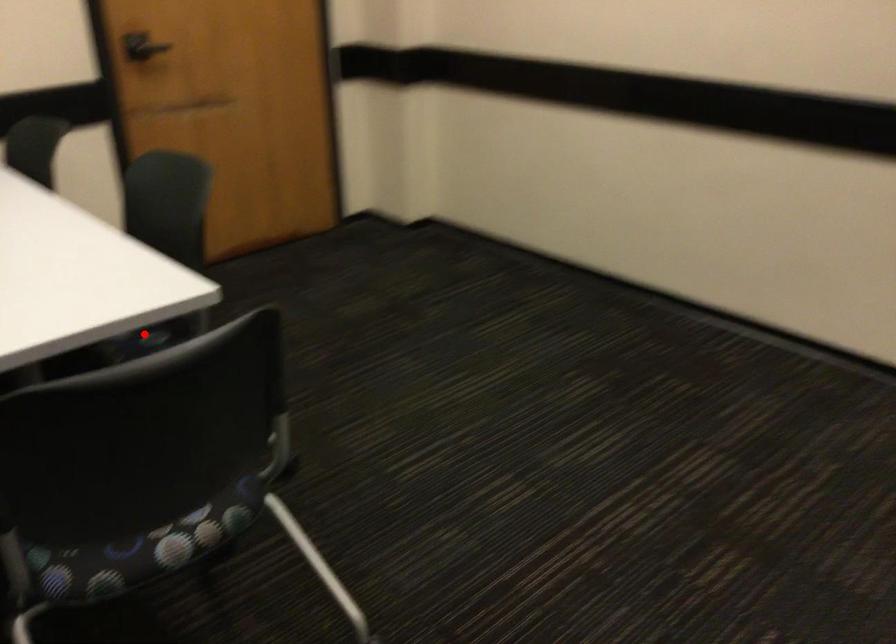
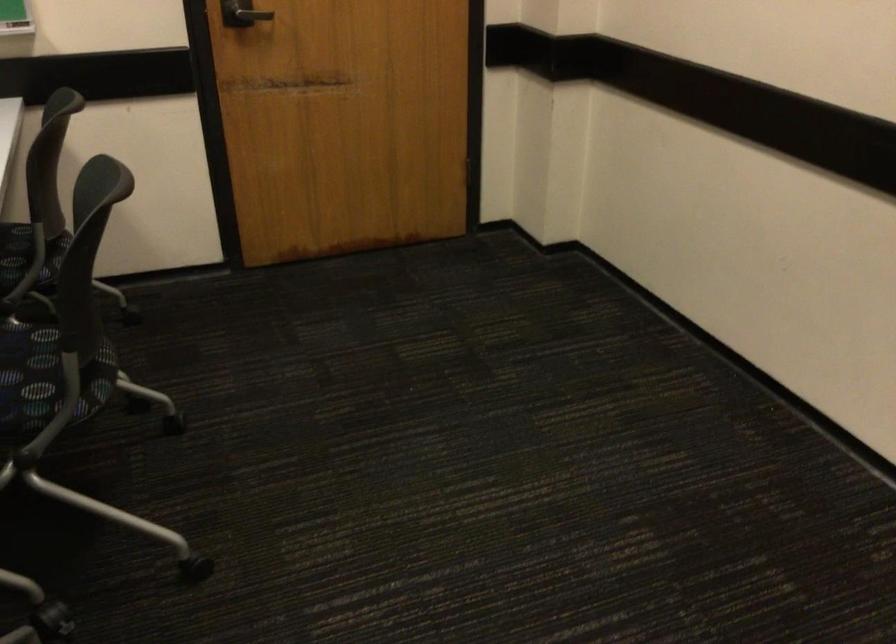
Question: I am providing you with two images of the same scene from different viewpoints. In image1, a red point is highlighted. Considering the same 3D point in image2, which of the following is correct?

Choices:
 (A) It is closer
 (B) It is farther

Answer: (A)